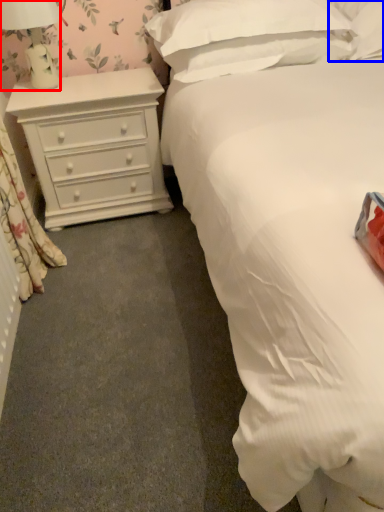
Question: Among these objects, which one is farthest to the camera, lamp (highlighted by a red box) or pillow (highlighted by a blue box)?

Choices:
 (A) lamp
 (B) pillow

Answer: (B)